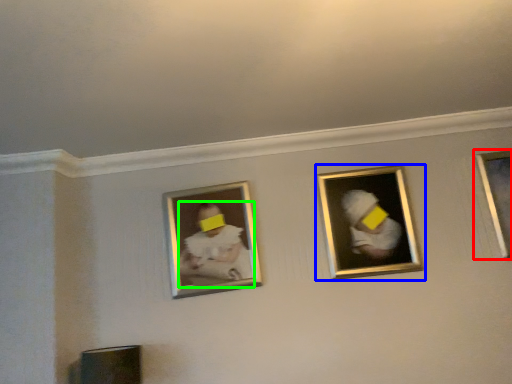
Question: Estimate the real-world distances between objects in this image. Which object is farther from picture frame (highlighted by a red box), picture frame (highlighted by a blue box) or person (highlighted by a green box)?

Choices:
 (A) picture frame
 (B) person

Answer: (B)